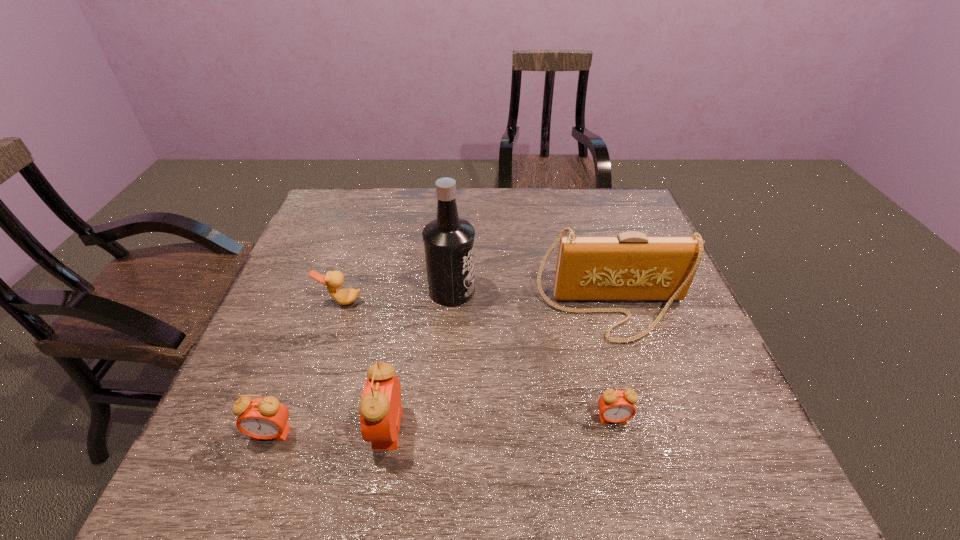
Where is `vacant space at the near edge of the desktop`? vacant space at the near edge of the desktop is located at coordinates (427, 422).

Image resolution: width=960 pixels, height=540 pixels. In order to click on vacant space at the left edge in this screenshot , I will do `click(313, 263)`.

Where is `vacant space at the far left corner`? vacant space at the far left corner is located at coordinates (324, 209).

The height and width of the screenshot is (540, 960). Find the location of `free space between the duck and the handbag`. free space between the duck and the handbag is located at coordinates (476, 306).

What are the coordinates of `free space that is in between the shortest alarm clock and the handbag` in the screenshot? It's located at (612, 364).

You are a GUI agent. You are given a task and a screenshot of the screen. Output one action in this format:
    pyautogui.click(x=<x>, y=<y>)
    Task: Click on the empty space between the fourth object from right to left and the handbag
    
    Given the screenshot: What is the action you would take?
    pyautogui.click(x=499, y=369)

Locate an element on the screen. This screenshot has height=540, width=960. blank region between the leftmost alarm clock and the shortest alarm clock is located at coordinates (443, 426).

At what (x,y) coordinates should I click in order to perform the action: click on vacant area that lies between the shortest alarm clock and the second alarm clock from left to right. Please return your answer as a coordinate pair (x, y). Looking at the image, I should click on (500, 423).

At what (x,y) coordinates should I click in order to perform the action: click on free point between the rightmost alarm clock and the fourth object from left to right. Please return your answer as a coordinate pair (x, y). Looking at the image, I should click on (533, 354).

Where is `vacant space that is in between the duck and the handbag`? The width and height of the screenshot is (960, 540). vacant space that is in between the duck and the handbag is located at coordinates (476, 306).